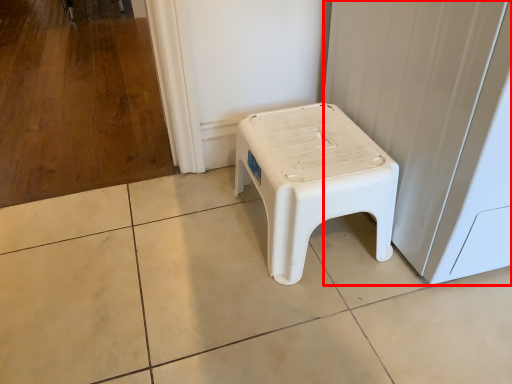
Question: From the image's perspective, where is screen door (annotated by the red box) located in relation to stool in the image?

Choices:
 (A) below
 (B) above

Answer: (B)